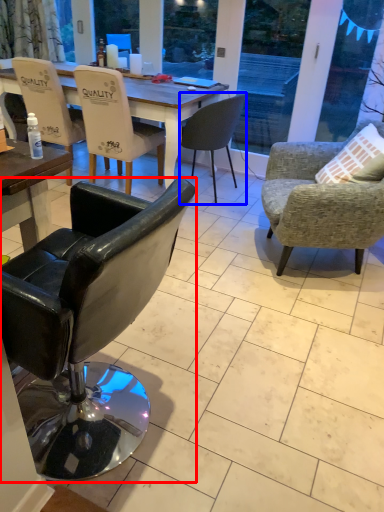
Question: Which object is further to the camera taking this photo, chair (highlighted by a red box) or chair (highlighted by a blue box)?

Choices:
 (A) chair
 (B) chair

Answer: (B)